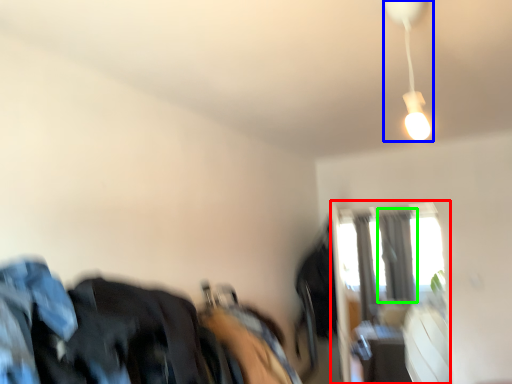
Question: Considering the real-world distances, which object is closest to window (highlighted by a red box)? lamp (highlighted by a blue box) or curtain (highlighted by a green box).

Choices:
 (A) lamp
 (B) curtain

Answer: (B)